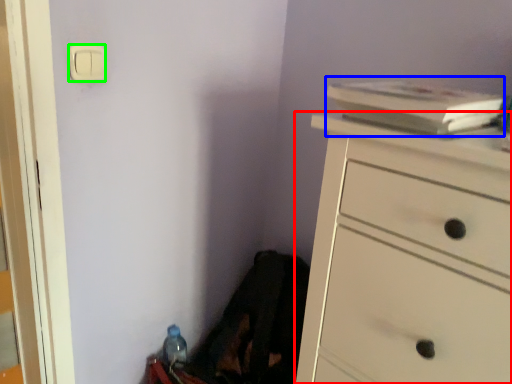
Question: Based on their relative distances, which object is nearer to chest of drawers (highlighted by a red box)? Choose from book (highlighted by a blue box) and light switch (highlighted by a green box).

Choices:
 (A) book
 (B) light switch

Answer: (A)